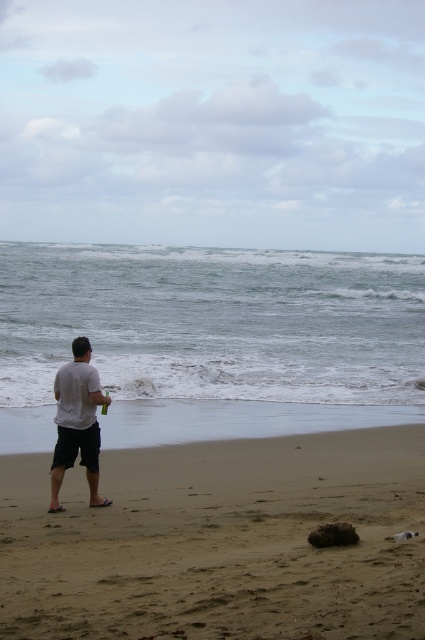
Between sandy at left and white matte shirt at center, which one appears on the left side from the viewer's perspective?

Positioned to the left is white matte shirt at center.

Between point (192, 572) and point (82, 460), which one is positioned in front?

Point (192, 572) is more forward.

Locate an element on the screen. The image size is (425, 640). sandy at left is located at coordinates (220, 540).